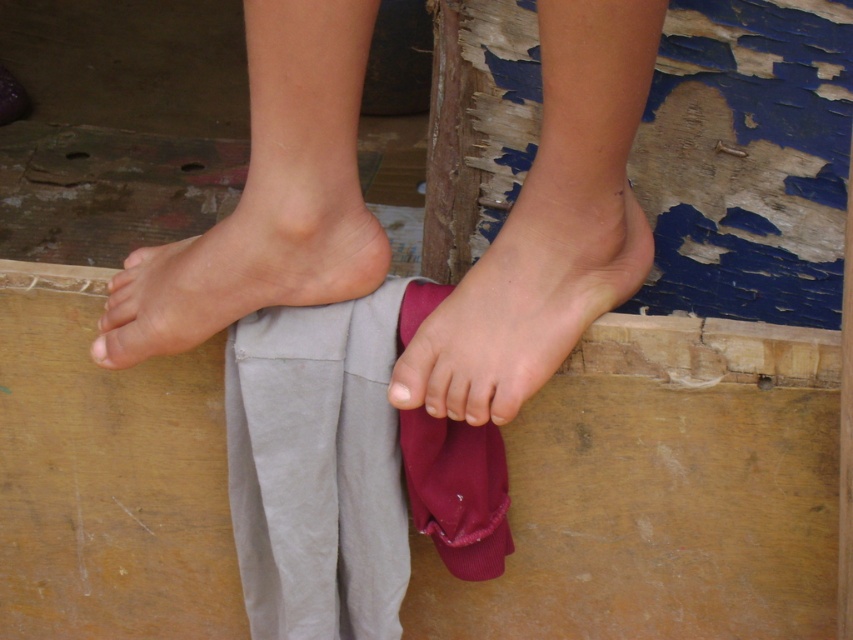
You are a photographer trying to capture both the smooth skin feet at center and the pink soft skin at center in a single frame. Since the camera has a limited focus area, which object should you prioritize focusing on to ensure it appears clearer due to its size?

The smooth skin feet at center is larger in size than the pink soft skin at center, so you should prioritize focusing on the smooth skin feet at center to ensure it appears clearer in the photo.